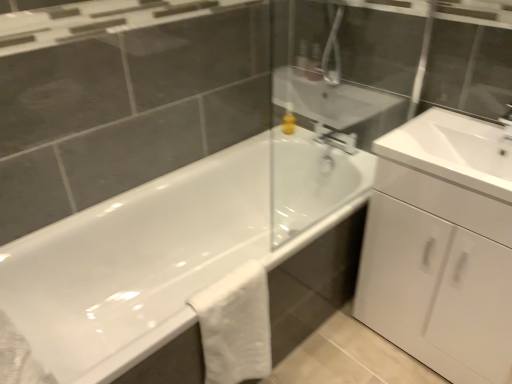
What is the approximate width of yellow matte soap dispenser at upper center?

yellow matte soap dispenser at upper center is 3.34 inches wide.

You are a GUI agent. You are given a task and a screenshot of the screen. Output one action in this format:
    pyautogui.click(x=<x>, y=<y>)
    Task: Click on the white glossy cabinet at right
    The image size is (512, 384).
    Given the screenshot: What is the action you would take?
    pyautogui.click(x=438, y=274)

Describe the element at coordinates (452, 151) in the screenshot. I see `white glossy sink at right` at that location.

What is the approximate width of white cotton towel at lower center?

white cotton towel at lower center is 7.23 inches in width.

This screenshot has width=512, height=384. Find the location of `white glossy bathtub at center`. white glossy bathtub at center is located at coordinates click(x=168, y=250).

Is yellow matte soap dispenser at upper center to the right of white glossy sink at right from the viewer's perspective?

Incorrect, yellow matte soap dispenser at upper center is not on the right side of white glossy sink at right.

Between yellow matte soap dispenser at upper center and white glossy sink at right, which one is positioned behind?

yellow matte soap dispenser at upper center is behind.

How many degrees apart are the facing directions of yellow matte soap dispenser at upper center and white glossy sink at right?

The angular difference between yellow matte soap dispenser at upper center and white glossy sink at right is 1.28 degrees.

Are yellow matte soap dispenser at upper center and white glossy sink at right far apart?

That's not correct — yellow matte soap dispenser at upper center is a little close to white glossy sink at right.

This screenshot has height=384, width=512. Identify the location of soap dispenser on the left of the white glossy cabinet at right. pos(289,120).

Between white glossy cabinet at right and yellow matte soap dispenser at upper center, which one has smaller size?

yellow matte soap dispenser at upper center.

Does white glossy cabinet at right have a lesser width compared to yellow matte soap dispenser at upper center?

No, white glossy cabinet at right is not thinner than yellow matte soap dispenser at upper center.

The width and height of the screenshot is (512, 384). I want to click on bath towel that is on the left side of yellow matte soap dispenser at upper center, so click(234, 326).

Is white cotton towel at lower center positioned with its back to yellow matte soap dispenser at upper center?

No.

From a real-world perspective, between white cotton towel at lower center and yellow matte soap dispenser at upper center, who is vertically higher?

yellow matte soap dispenser at upper center is physically above.

Is white cotton towel at lower center placed right next to yellow matte soap dispenser at upper center?

No, white cotton towel at lower center is not in contact with yellow matte soap dispenser at upper center.

Is white cotton towel at lower center in contact with white glossy sink at right?

No, white cotton towel at lower center is not making contact with white glossy sink at right.

Is white glossy sink at right surrounded by white cotton towel at lower center?

Definitely not — white glossy sink at right is not inside white cotton towel at lower center.

Between white cotton towel at lower center and white glossy sink at right, which one is positioned in front?

white cotton towel at lower center.

How distant is white cotton towel at lower center from white glossy sink at right?

white cotton towel at lower center and white glossy sink at right are 29.01 inches apart.

Is point (117, 210) in front of point (286, 112)?

Yes, it is in front of point (286, 112).

Is white glossy bathtub at center looking in the opposite direction of yellow matte soap dispenser at upper center?

No, white glossy bathtub at center is not facing the opposite direction of yellow matte soap dispenser at upper center.

From their relative heights in the image, would you say white glossy bathtub at center is taller or shorter than yellow matte soap dispenser at upper center?

Considering their sizes, white glossy bathtub at center has more height than yellow matte soap dispenser at upper center.

Between white glossy bathtub at center and yellow matte soap dispenser at upper center, which one appears on the right side from the viewer's perspective?

From the viewer's perspective, yellow matte soap dispenser at upper center appears more on the right side.

Looking at this image, which is less distant, (490, 337) or (21, 266)?

The point (490, 337) is closer to the camera.

Where is `bathtub in front of the white glossy cabinet at right`? bathtub in front of the white glossy cabinet at right is located at coordinates (168, 250).

Does white glossy cabinet at right have a greater width compared to white glossy bathtub at center?

No, white glossy cabinet at right is not wider than white glossy bathtub at center.

Is white glossy bathtub at center bigger or smaller than white glossy sink at right?

In the image, white glossy bathtub at center appears to be larger than white glossy sink at right.

From a real-world perspective, is white glossy bathtub at center physically located above or below white glossy sink at right?

In terms of real-world spatial position, white glossy bathtub at center is below white glossy sink at right.

Considering the relative positions of white glossy bathtub at center and white glossy sink at right in the image provided, is white glossy bathtub at center to the left of white glossy sink at right from the viewer's perspective?

Indeed, white glossy bathtub at center is positioned on the left side of white glossy sink at right.

Image resolution: width=512 pixels, height=384 pixels. Identify the location of soap dispenser above the white glossy sink at right (from the image's perspective). tap(289, 120).

Where is `cabinetry located below the yellow matte soap dispenser at upper center (from the image's perspective)`? The image size is (512, 384). cabinetry located below the yellow matte soap dispenser at upper center (from the image's perspective) is located at coordinates (438, 274).

Looking at the image, which one is located further to white glossy sink at right, white glossy bathtub at center or white glossy cabinet at right?

The object further to white glossy sink at right is white glossy bathtub at center.

Looking at the image, which one is located further to white glossy cabinet at right, white cotton towel at lower center or white glossy sink at right?

Among the two, white cotton towel at lower center is located further to white glossy cabinet at right.

From the image, which object appears to be nearer to white glossy sink at right, white glossy cabinet at right or white cotton towel at lower center?

Based on the image, white glossy cabinet at right appears to be nearer to white glossy sink at right.

Looking at the image, which one is located closer to white glossy bathtub at center, white glossy cabinet at right or yellow matte soap dispenser at upper center?

Among the two, white glossy cabinet at right is located nearer to white glossy bathtub at center.

Estimate the real-world distances between objects in this image. Which object is closer to white glossy sink at right, yellow matte soap dispenser at upper center or white glossy cabinet at right?

Among the two, white glossy cabinet at right is located nearer to white glossy sink at right.

Considering their positions, is white cotton towel at lower center positioned closer to white glossy sink at right than white glossy bathtub at center?

white glossy bathtub at center.

Estimate the real-world distances between objects in this image. Which object is closer to white cotton towel at lower center, white glossy cabinet at right or yellow matte soap dispenser at upper center?

Based on the image, white glossy cabinet at right appears to be nearer to white cotton towel at lower center.

Looking at the image, which one is located closer to white cotton towel at lower center, white glossy cabinet at right or white glossy bathtub at center?

Based on the image, white glossy bathtub at center appears to be nearer to white cotton towel at lower center.

At what (x,y) coordinates should I click in order to perform the action: click on sink positioned between white glossy cabinet at right and yellow matte soap dispenser at upper center from near to far. Please return your answer as a coordinate pair (x, y). The image size is (512, 384). Looking at the image, I should click on (452, 151).

Find the location of `sink between white glossy bathtub at center and yellow matte soap dispenser at upper center along the z-axis`. sink between white glossy bathtub at center and yellow matte soap dispenser at upper center along the z-axis is located at coordinates (452, 151).

I want to click on bath towel between white glossy bathtub at center and white glossy cabinet at right in the horizontal direction, so click(x=234, y=326).

I want to click on bath towel between white glossy bathtub at center and yellow matte soap dispenser at upper center along the z-axis, so click(234, 326).